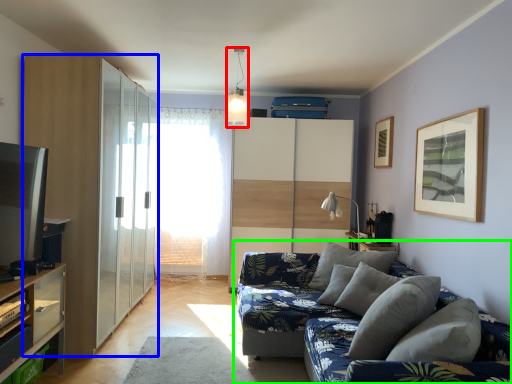
Question: Based on their relative distances, which object is nearer to light fixture (highlighted by a red box)? Choose from dresser (highlighted by a blue box) and studio couch (highlighted by a green box).

Choices:
 (A) dresser
 (B) studio couch

Answer: (A)